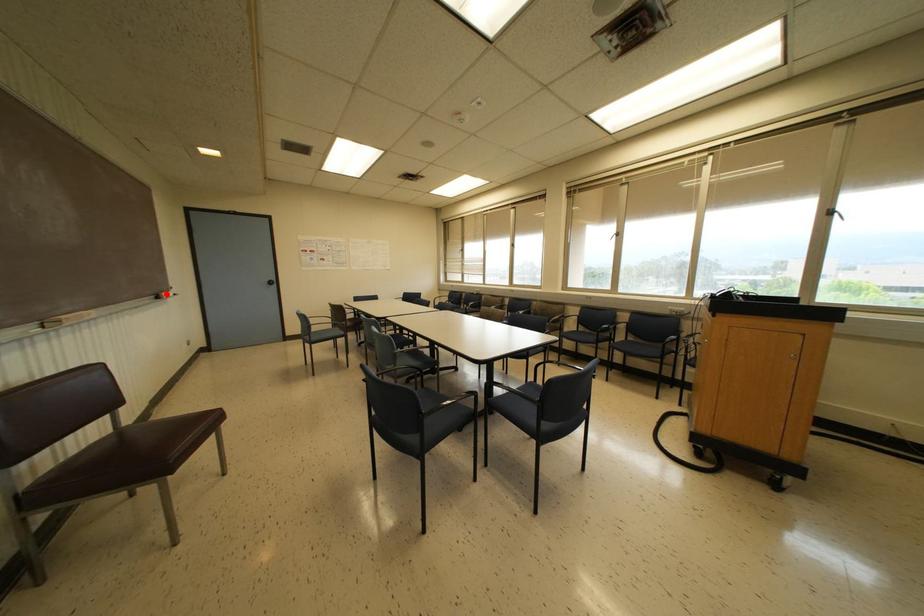
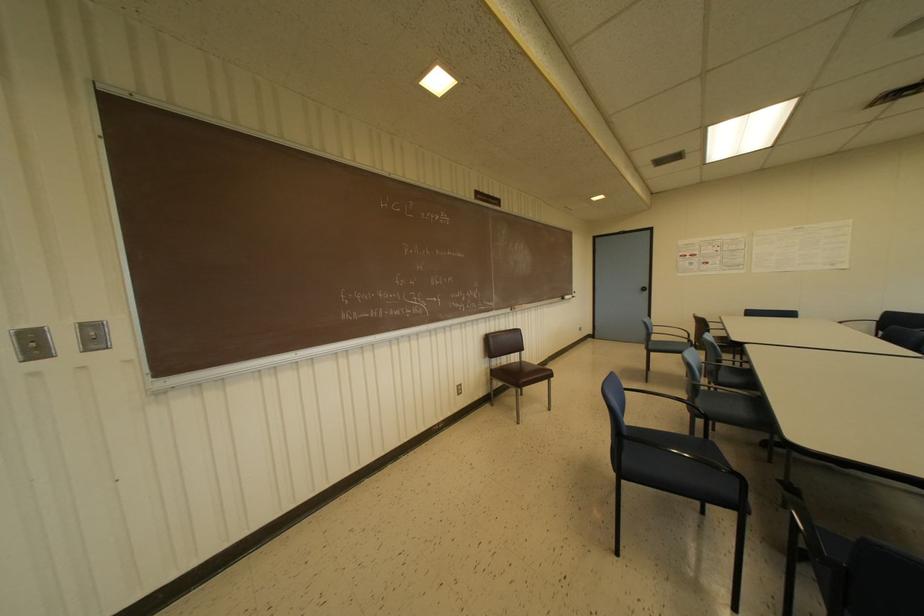
Find the pixel in the second image that matches the highlighted location in the first image.

(565, 296)